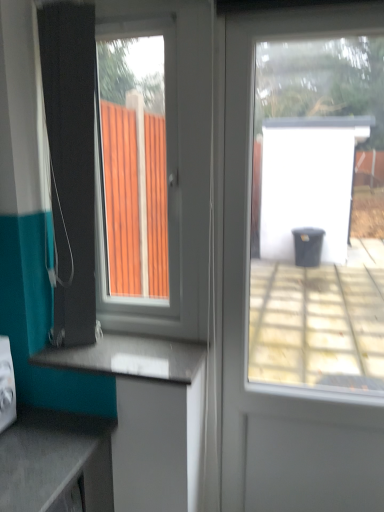
In order to click on free space above smooth gray countertop at lower center (from a real-world perspective) in this screenshot , I will do `click(139, 351)`.